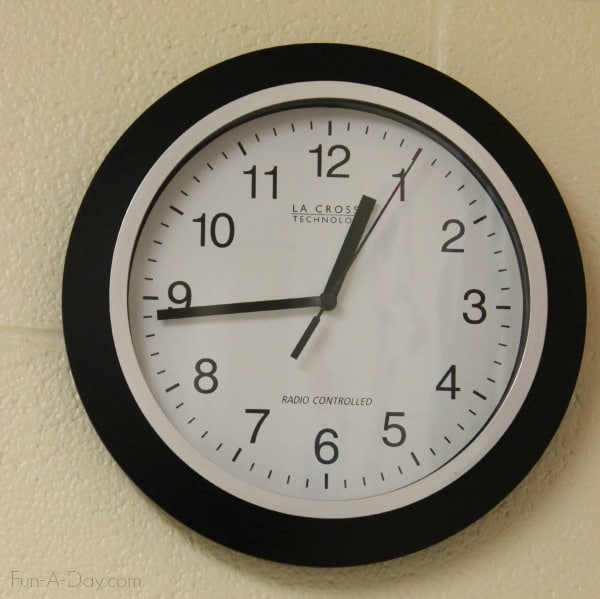
Where is `clock face`? This screenshot has height=599, width=600. clock face is located at coordinates (371, 314).